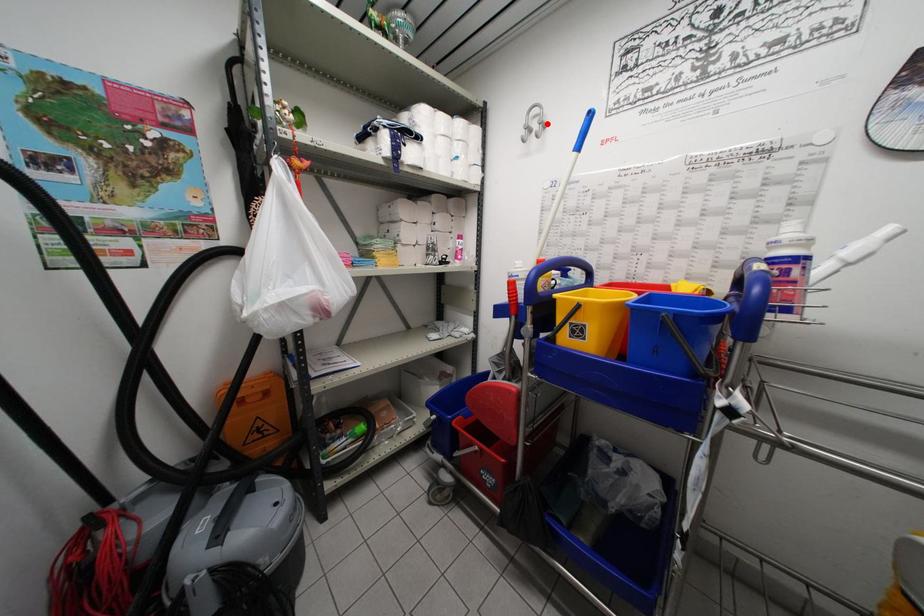
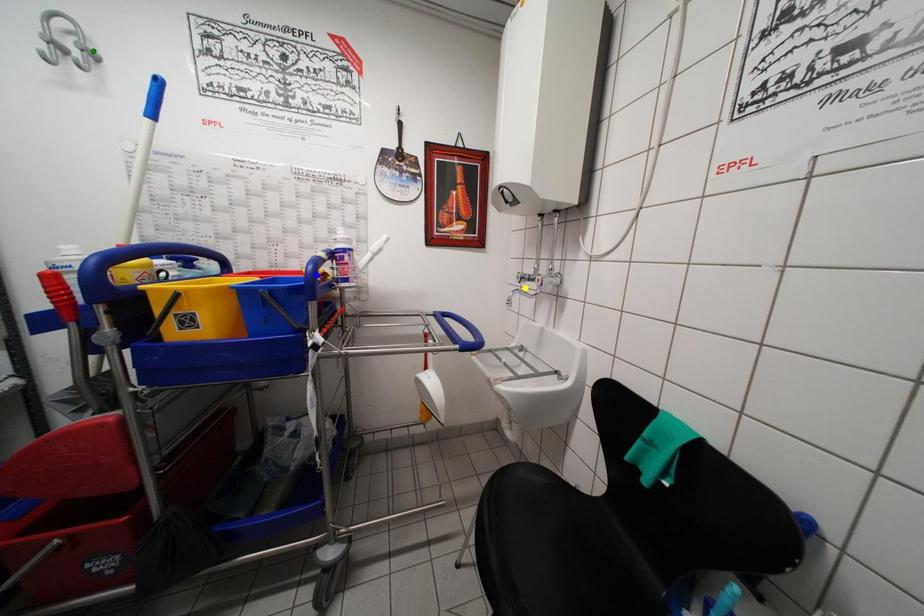
Question: I am providing you with two images of the same scene from different viewpoints. A red point is marked on the first image. You are given multiple points on the second image. Which spot in image 2 lines up with the point in image 1?

Choices:
 (A) yellow point
 (B) blue point
 (C) green point

Answer: (C)